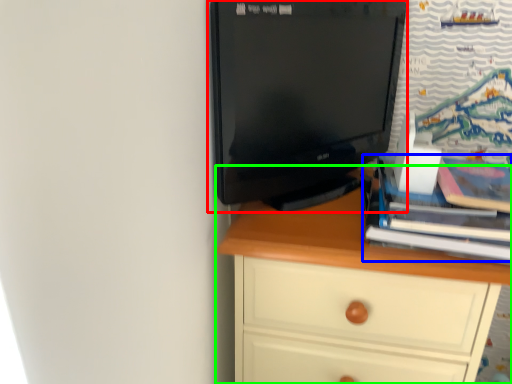
Question: Based on their relative distances, which object is nearer to computer monitor (highlighted by a red box)? Choose from book (highlighted by a blue box) and chest of drawers (highlighted by a green box).

Choices:
 (A) book
 (B) chest of drawers

Answer: (B)